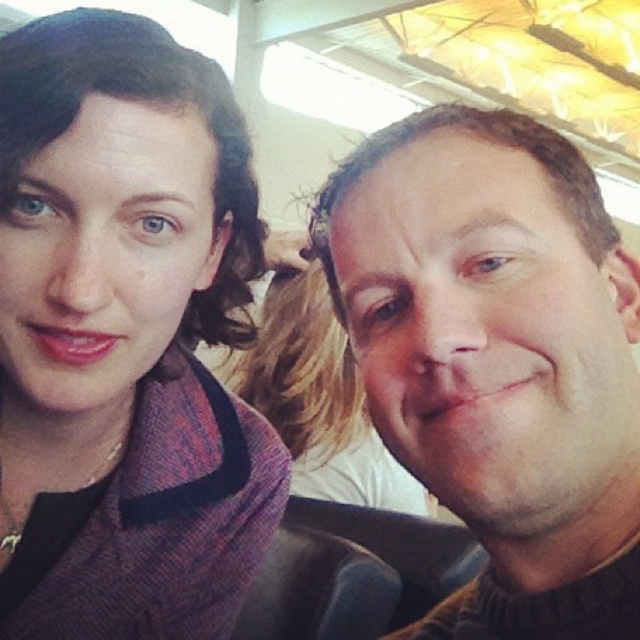
Which is below, matte purple scarf at upper left or smooth skin face at center?

smooth skin face at center is below.

This screenshot has height=640, width=640. What do you see at coordinates (124, 337) in the screenshot?
I see `matte purple scarf at upper left` at bounding box center [124, 337].

Identify the location of matte purple scarf at upper left. The height and width of the screenshot is (640, 640). (124, 337).

Does brown fuzzy sweater at right have a greater width compared to smooth skin face at center?

In fact, brown fuzzy sweater at right might be narrower than smooth skin face at center.

Does brown fuzzy sweater at right have a greater height compared to smooth skin face at center?

No, brown fuzzy sweater at right is not taller than smooth skin face at center.

This screenshot has width=640, height=640. Identify the location of brown fuzzy sweater at right. (497, 358).

Does matte purple scarf at upper left have a smaller size compared to brown fuzzy sweater at right?

Actually, matte purple scarf at upper left might be larger than brown fuzzy sweater at right.

Is matte purple scarf at upper left bigger than brown fuzzy sweater at right?

Yes, matte purple scarf at upper left is bigger than brown fuzzy sweater at right.

Where is `matte purple scarf at upper left`? matte purple scarf at upper left is located at coordinates (124, 337).